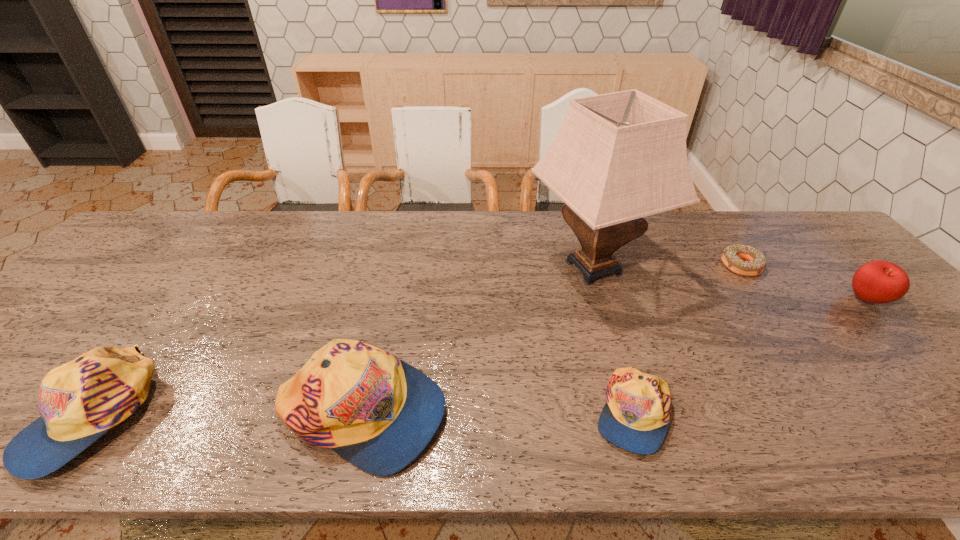
Identify the location of the fifth object from right to left. Image resolution: width=960 pixels, height=540 pixels. (379, 413).

Find the location of a particular element. The height and width of the screenshot is (540, 960). the rightmost cap is located at coordinates (636, 416).

Identify the location of the fifth tallest object. This screenshot has height=540, width=960. (636, 416).

This screenshot has width=960, height=540. Identify the location of the tallest object. (618, 157).

Find the location of a particular element. The height and width of the screenshot is (540, 960). doughnut is located at coordinates (732, 256).

Locate an element on the screen. the fifth object from left to right is located at coordinates (732, 256).

You are a GUI agent. You are given a task and a screenshot of the screen. Output one action in this format:
    pyautogui.click(x=<x>, y=<y>)
    Task: Click on the rightmost object
    The height and width of the screenshot is (540, 960).
    Given the screenshot: What is the action you would take?
    pyautogui.click(x=878, y=282)

The width and height of the screenshot is (960, 540). In order to click on vacant space located on the bill of the second cap from left to right in this screenshot , I will do `click(633, 413)`.

Where is `vacant space located 0.220m on the right of the tallest object`? vacant space located 0.220m on the right of the tallest object is located at coordinates (736, 268).

What are the coordinates of `free region located on the left of the second object from right to left` in the screenshot? It's located at (705, 266).